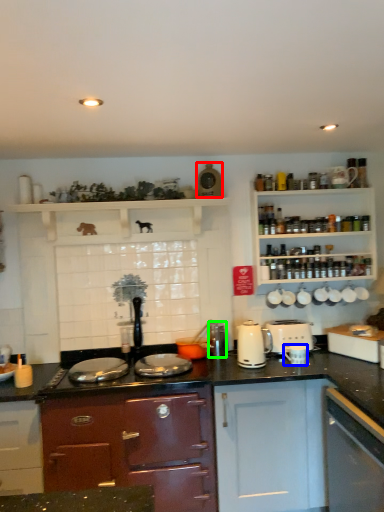
Question: Considering the real-world distances, which object is farthest from appliance (highlighted by a red box)? appliance (highlighted by a blue box) or appliance (highlighted by a green box)?

Choices:
 (A) appliance
 (B) appliance

Answer: (A)